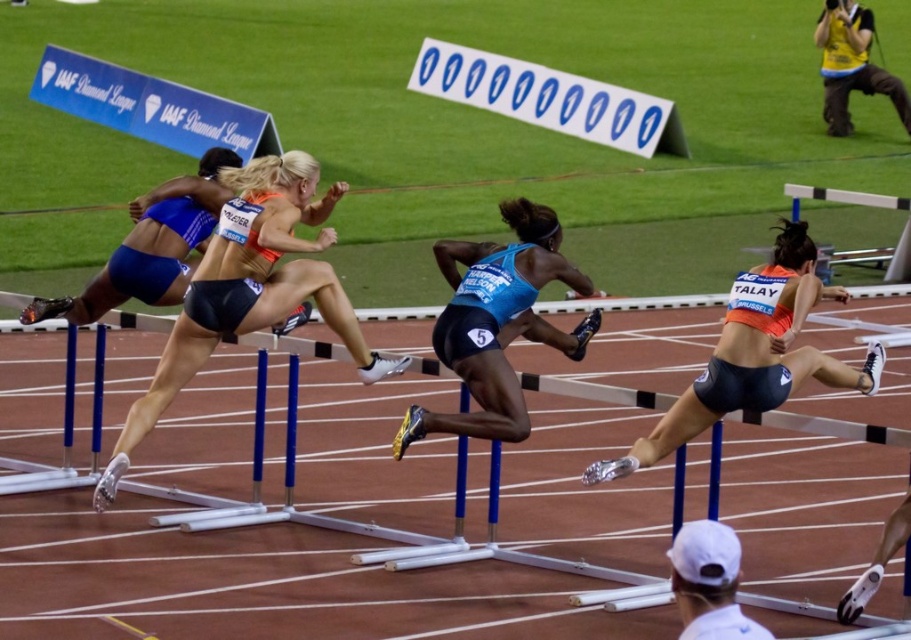
Question: Which of the following is the closest to the observer?

Choices:
 (A) white plastic finish line at upper center
 (B) blue plastic hurdle at center
 (C) yellow fabric camera at upper right
 (D) matte black shorts at center

Answer: (D)

Question: Does blue plastic hurdle at center appear under blue matte running shorts at center?

Choices:
 (A) no
 (B) yes

Answer: (B)

Question: Which point is closer to the camera?

Choices:
 (A) white plastic finish line at upper center
 (B) blue matte running shorts at center
 (C) yellow fabric camera at upper right

Answer: (B)

Question: Where is blue matte running shorts at center located in relation to white plastic finish line at upper center in the image?

Choices:
 (A) right
 (B) left

Answer: (B)

Question: Is matte black shorts at center in front of blue matte running shorts at center?

Choices:
 (A) yes
 (B) no

Answer: (A)

Question: Considering the real-world distances, which object is farthest from the white plastic finish line at upper center?

Choices:
 (A) matte black shorts at center
 (B) yellow fabric camera at upper right
 (C) orange matte shorts at right

Answer: (C)